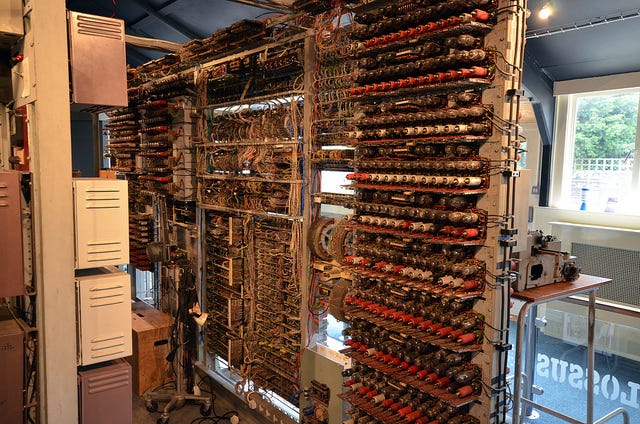
Image resolution: width=640 pixels, height=424 pixels. I want to click on metal frame, so click(589, 332).